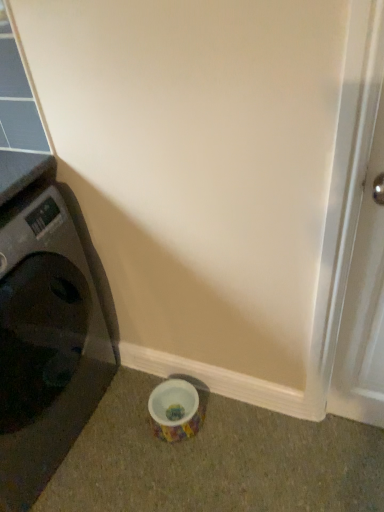
This screenshot has width=384, height=512. What do you see at coordinates (364, 255) in the screenshot?
I see `white glossy screen door at right` at bounding box center [364, 255].

You are a GUI agent. You are given a task and a screenshot of the screen. Output one action in this format:
    pyautogui.click(x=<x>, y=<y>)
    Task: Click on the white glossy screen door at right
    This screenshot has height=512, width=384.
    Given the screenshot: What is the action you would take?
    pyautogui.click(x=364, y=255)

The width and height of the screenshot is (384, 512). Find the location of `black plastic washing machine at left`. black plastic washing machine at left is located at coordinates (45, 344).

This screenshot has height=512, width=384. What do you see at coordinates (45, 344) in the screenshot?
I see `black plastic washing machine at left` at bounding box center [45, 344].

The image size is (384, 512). I want to click on white glossy screen door at right, so click(x=364, y=255).

Can you confirm if black plastic washing machine at left is positioned to the right of white glossy screen door at right?

In fact, black plastic washing machine at left is to the left of white glossy screen door at right.

Is black plastic washing machine at left positioned before white glossy screen door at right?

No, black plastic washing machine at left is further to the viewer.

Considering the positions of point (12, 215) and point (353, 355), is point (12, 215) closer or farther from the camera than point (353, 355)?

Point (12, 215) is closer to the camera than point (353, 355).

From the image's perspective, between black plastic washing machine at left and white glossy screen door at right, who is located below?

From the image's view, black plastic washing machine at left is below.

From a real-world perspective, who is located higher, black plastic washing machine at left or white glossy screen door at right?

In real-world perspective, white glossy screen door at right is above.

Between black plastic washing machine at left and white glossy screen door at right, which one has smaller width?

Thinner between the two is white glossy screen door at right.

Can you confirm if black plastic washing machine at left is shorter than white glossy screen door at right?

Correct, black plastic washing machine at left is not as tall as white glossy screen door at right.

Can you confirm if black plastic washing machine at left is smaller than white glossy screen door at right?

No.

Choose the correct answer: Is black plastic washing machine at left inside white glossy screen door at right or outside it?

black plastic washing machine at left is outside white glossy screen door at right.

Is black plastic washing machine at left next to white glossy screen door at right?

No, black plastic washing machine at left is not next to white glossy screen door at right.

Is black plastic washing machine at left facing away from white glossy screen door at right?

No, black plastic washing machine at left is not facing the opposite direction of white glossy screen door at right.

How different are the orientations of black plastic washing machine at left and white glossy screen door at right in degrees?

black plastic washing machine at left and white glossy screen door at right are facing 90 degrees away from each other.

How much distance is there between black plastic washing machine at left and white glossy screen door at right?

black plastic washing machine at left is 90.60 centimeters away from white glossy screen door at right.

Where is `screen door in front of the black plastic washing machine at left`? screen door in front of the black plastic washing machine at left is located at coordinates (364, 255).

Considering the positions of objects white glossy screen door at right and black plastic washing machine at left in the image provided, who is more to the left, white glossy screen door at right or black plastic washing machine at left?

From the viewer's perspective, black plastic washing machine at left appears more on the left side.

Consider the image. Relative to black plastic washing machine at left, is white glossy screen door at right in front or behind?

white glossy screen door at right is in front of black plastic washing machine at left.

Is point (368, 143) more distant than point (49, 277)?

No, (368, 143) is in front of (49, 277).

From the image's perspective, is white glossy screen door at right located above or below black plastic washing machine at left?

Clearly, from the image's perspective, white glossy screen door at right is above black plastic washing machine at left.

From a real-world perspective, which is physically above, white glossy screen door at right or black plastic washing machine at left?

white glossy screen door at right is physically above.

Considering the relative sizes of white glossy screen door at right and black plastic washing machine at left in the image provided, is white glossy screen door at right wider than black plastic washing machine at left?

No, white glossy screen door at right is not wider than black plastic washing machine at left.

Between white glossy screen door at right and black plastic washing machine at left, which one has less height?

Standing shorter between the two is black plastic washing machine at left.

Considering the sizes of objects white glossy screen door at right and black plastic washing machine at left in the image provided, who is smaller, white glossy screen door at right or black plastic washing machine at left?

white glossy screen door at right.

Would you say white glossy screen door at right is outside black plastic washing machine at left?

Yes, white glossy screen door at right is outside of black plastic washing machine at left.

Is white glossy screen door at right far from black plastic washing machine at left?

No.

Is white glossy screen door at right oriented away from black plastic washing machine at left?

No.

Can you tell me how much white glossy screen door at right and black plastic washing machine at left differ in facing direction?

The angular difference between white glossy screen door at right and black plastic washing machine at left is 90 degrees.

I want to click on screen door above the black plastic washing machine at left (from a real-world perspective), so (x=364, y=255).

Identify the location of screen door on the right side of black plastic washing machine at left. (364, 255).

Find the location of a particular element. Image resolution: width=384 pixels, height=512 pixels. screen door located in front of the black plastic washing machine at left is located at coordinates (364, 255).